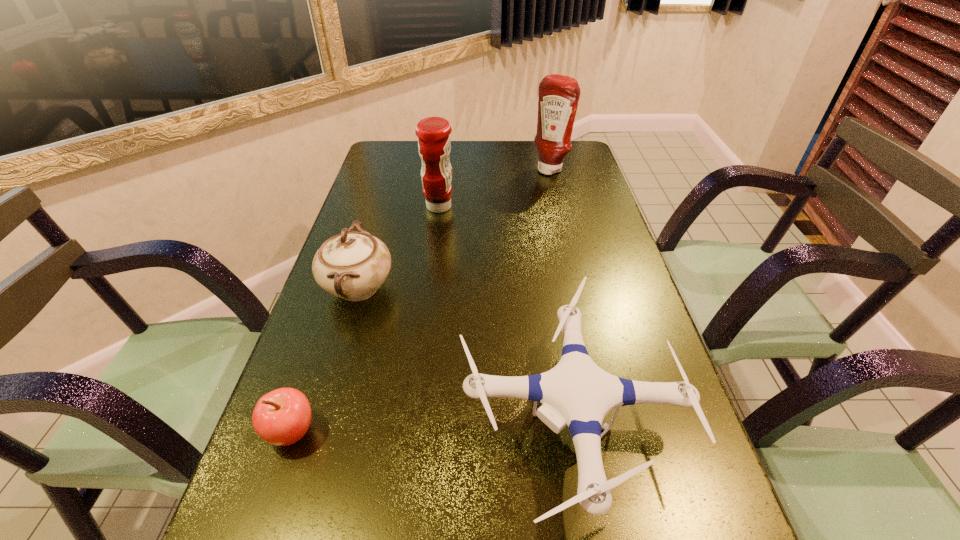
The width and height of the screenshot is (960, 540). Identify the location of the farther condiment. (559, 95).

Find the location of a particular element. The height and width of the screenshot is (540, 960). the tallest object is located at coordinates (559, 95).

The image size is (960, 540). Identify the location of the left condiment. (434, 145).

In order to click on the shorter condiment in this screenshot , I will do `click(434, 145)`.

You are a GUI agent. You are given a task and a screenshot of the screen. Output one action in this format:
    pyautogui.click(x=<x>, y=<y>)
    Task: Click on the chinaware
    The width and height of the screenshot is (960, 540).
    Given the screenshot: What is the action you would take?
    pyautogui.click(x=352, y=265)

The height and width of the screenshot is (540, 960). What are the coordinates of `apple` in the screenshot? It's located at (281, 417).

Identify the location of free space located 0.070m on the front of the farthest object. Image resolution: width=960 pixels, height=540 pixels. (555, 188).

Where is `vacant space situated on the front of the fourth nearest object`? Image resolution: width=960 pixels, height=540 pixels. vacant space situated on the front of the fourth nearest object is located at coordinates (435, 236).

Identify the location of vacant region located 0.300m on the front of the chinaware. The width and height of the screenshot is (960, 540). (307, 458).

I want to click on vacant space situated on the back of the apple, so click(x=313, y=369).